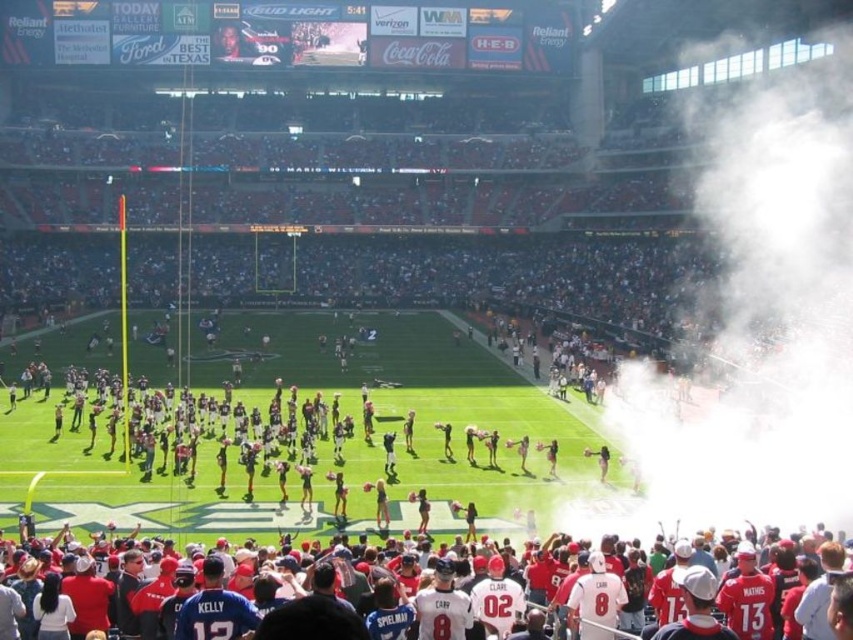
Is point (709, 392) less distant than point (219, 609)?

No, (709, 392) is behind (219, 609).

Does white fog at right have a larger size compared to red jersey fans at lower center?

Correct, white fog at right is larger in size than red jersey fans at lower center.

Which is behind, point (721, 328) or point (735, 612)?

Positioned behind is point (721, 328).

Locate an element on the screen. white fog at right is located at coordinates (761, 323).